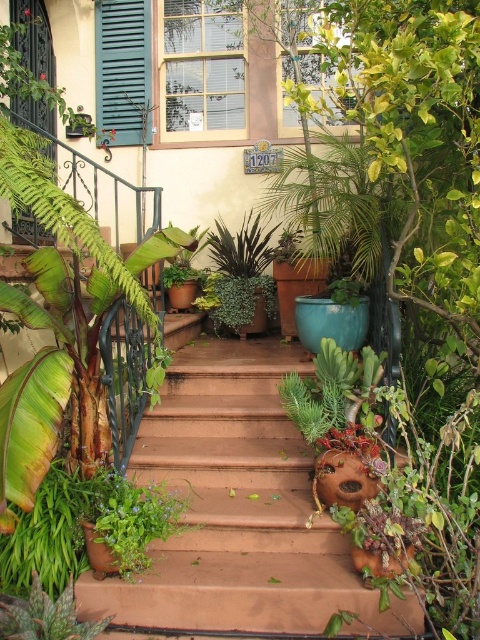
Between brown concrete stairs at center and green matte shutter at upper left, which one appears on the left side from the viewer's perspective?

Positioned to the left is green matte shutter at upper left.

Does brown concrete stairs at center have a greater height compared to green matte shutter at upper left?

No, brown concrete stairs at center is not taller than green matte shutter at upper left.

Locate an element on the screen. brown concrete stairs at center is located at coordinates (238, 513).

The height and width of the screenshot is (640, 480). I want to click on brown concrete stairs at center, so click(x=238, y=513).